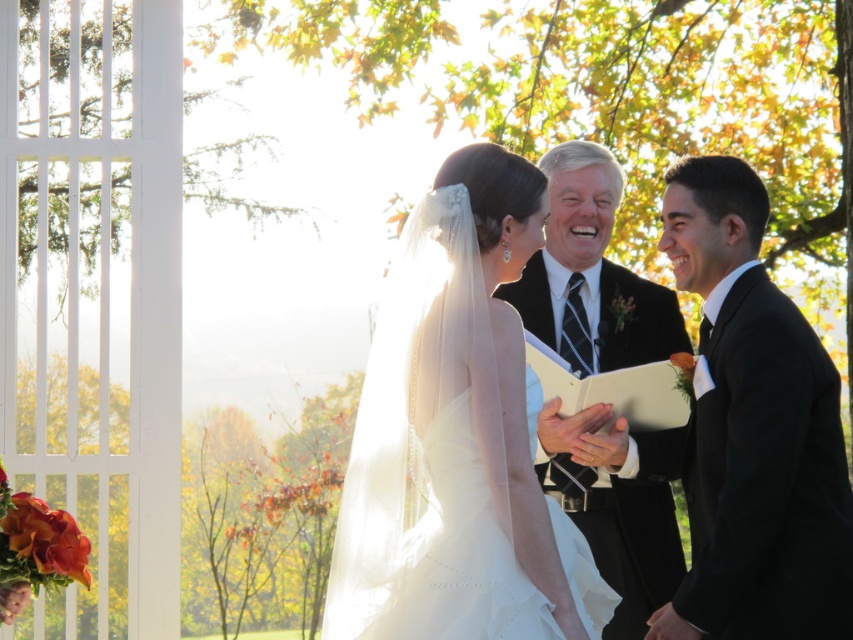
Question: Estimate the real-world distances between objects in this image. Which object is closer to the black satin suit at center?

Choices:
 (A) black satin suit at right
 (B) white satin dress at center

Answer: (A)

Question: Which point appears closest to the camera in this image?

Choices:
 (A) (666, 214)
 (B) (389, 352)
 (C) (590, 442)

Answer: (B)

Question: Considering the real-world distances, which object is farthest from the black satin suit at center?

Choices:
 (A) black satin suit at right
 (B) white satin dress at center

Answer: (B)

Question: Is white satin dress at center to the left of black satin suit at center from the viewer's perspective?

Choices:
 (A) no
 (B) yes

Answer: (B)

Question: Can you confirm if black satin suit at right is positioned above black satin suit at center?

Choices:
 (A) yes
 (B) no

Answer: (B)

Question: Can you confirm if white satin dress at center is thinner than black satin suit at center?

Choices:
 (A) no
 (B) yes

Answer: (A)